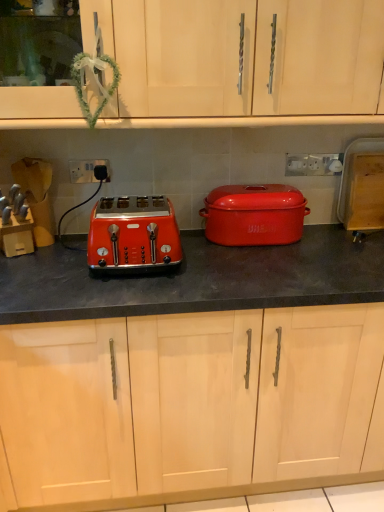
Question: Is matte red casserole at center to the left of matte wood cabinet at upper center, the 1th cabinetry in the top-to-bottom sequence, from the viewer's perspective?

Choices:
 (A) no
 (B) yes

Answer: (A)

Question: Is matte wood cabinet at upper center, the 1th cabinetry in the top-to-bottom sequence, completely or partially inside matte red casserole at center?

Choices:
 (A) no
 (B) yes

Answer: (A)

Question: Is the position of matte red casserole at center more distant than that of matte wood cabinet at upper center, the second cabinetry positioned from the bottom?

Choices:
 (A) no
 (B) yes

Answer: (B)

Question: Considering the relative sizes of matte red casserole at center and matte wood cabinet at upper center, the 1th cabinetry in the top-to-bottom sequence, in the image provided, is matte red casserole at center taller than matte wood cabinet at upper center, the 1th cabinetry in the top-to-bottom sequence,?

Choices:
 (A) no
 (B) yes

Answer: (A)

Question: Does matte red casserole at center have a larger size compared to matte wood cabinet at upper center, the second cabinetry positioned from the bottom?

Choices:
 (A) no
 (B) yes

Answer: (A)

Question: Is matte red casserole at center taller or shorter than matte orange toaster at left?

Choices:
 (A) tall
 (B) short

Answer: (B)

Question: From a real-world perspective, relative to matte orange toaster at left, is matte red casserole at center vertically above or below?

Choices:
 (A) above
 (B) below

Answer: (B)

Question: From the image's perspective, is matte red casserole at center positioned above or below matte orange toaster at left?

Choices:
 (A) below
 (B) above

Answer: (B)

Question: Is point (297, 212) closer or farther from the camera than point (139, 267)?

Choices:
 (A) closer
 (B) farther

Answer: (B)

Question: From a real-world perspective, is matte red casserole at center above or below matte wood cabinet at upper center, the second cabinetry positioned from the bottom?

Choices:
 (A) below
 (B) above

Answer: (A)

Question: Considering the positions of point (236, 219) and point (61, 115), is point (236, 219) closer or farther from the camera than point (61, 115)?

Choices:
 (A) farther
 (B) closer

Answer: (A)

Question: In terms of width, does matte red casserole at center look wider or thinner when compared to matte wood cabinet at upper center, the 1th cabinetry in the top-to-bottom sequence?

Choices:
 (A) thin
 (B) wide

Answer: (A)

Question: Is matte red casserole at center inside or outside of matte wood cabinet at upper center, the second cabinetry positioned from the bottom?

Choices:
 (A) outside
 (B) inside

Answer: (A)

Question: Considering the positions of point (132, 218) and point (134, 431), is point (132, 218) closer or farther from the camera than point (134, 431)?

Choices:
 (A) farther
 (B) closer

Answer: (B)

Question: Considering the positions of matte orange toaster at left and matte black toaster at left, which appears as the 2th cabinetry when viewed from the top, in the image, is matte orange toaster at left wider or thinner than matte black toaster at left, which appears as the 2th cabinetry when viewed from the top,?

Choices:
 (A) wide
 (B) thin

Answer: (B)